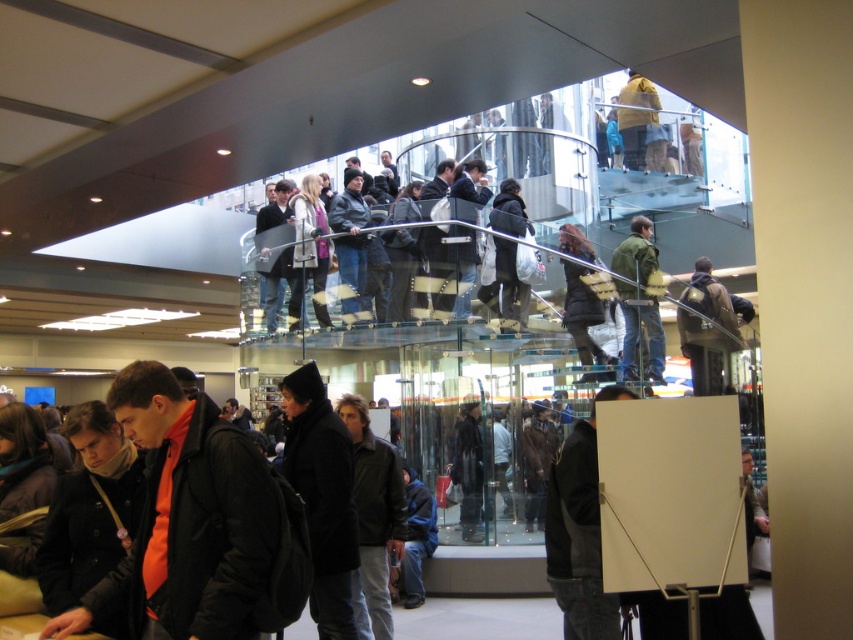
You are a store employee who needs to determine which of the two jackets at the center of the staircase is wider to decide which display stand to use. The black matte jacket at center and the green textured jacket at center are both on display. Which jacket is wider?

The green textured jacket at center is wider than the black matte jacket at center, so it requires a larger display stand.

You are standing at the bottom of the glass staircase and want to hand a note to both the person wearing the black matte jacket at center and the person wearing the green textured jacket at center. Which jacket should you look up towards to reach the person higher up?

The green textured jacket at center is higher up because the black matte jacket at center is positioned under it.

You are a store employee trying to decide which jacket to display in the window. The window has a limited height space. Which jacket between the black matte jacket at center and the green textured jacket at center would fit better in the window display?

The black matte jacket at center has a lesser height compared to the green textured jacket at center, so it would fit better in the window display with limited height space.